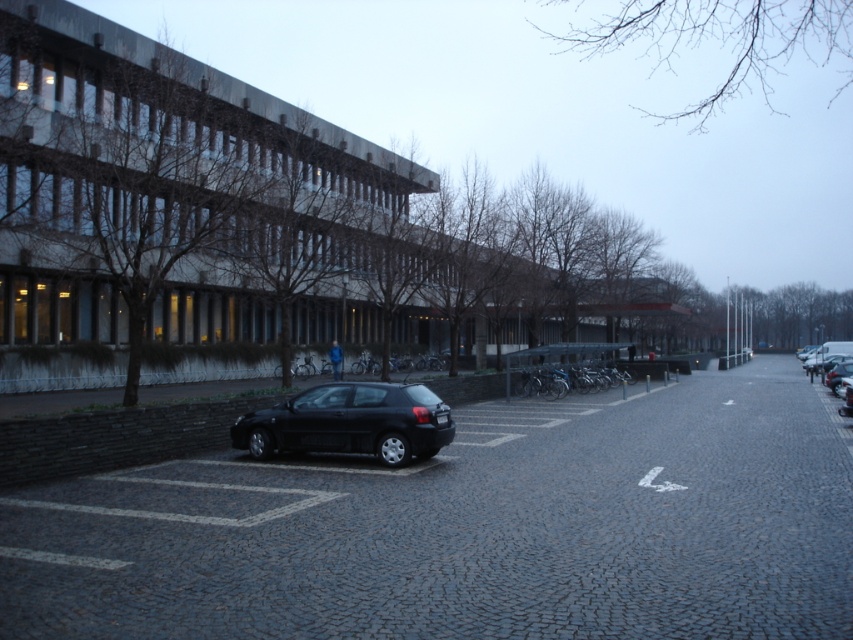
Describe the element at coordinates (469, 529) in the screenshot. The height and width of the screenshot is (640, 853). I see `shiny black car at center-left` at that location.

Does point (234, 627) come closer to viewer compared to point (807, 365)?

Yes, point (234, 627) is in front of point (807, 365).

The image size is (853, 640). Identify the location of shiny black car at center-left. (469, 529).

Is shiny black car at center-left shorter than shiny black hatchback at center?

Correct, shiny black car at center-left is not as tall as shiny black hatchback at center.

Find the location of a particular element. shiny black car at center-left is located at coordinates tap(469, 529).

In order to click on shiny black car at center-left in this screenshot , I will do `click(469, 529)`.

Which is more to the right, shiny black hatchback at center or metallic silver car at right?

metallic silver car at right is more to the right.

Does shiny black hatchback at center come behind metallic silver car at right?

No, shiny black hatchback at center is in front of metallic silver car at right.

Identify the location of shiny black hatchback at center. The height and width of the screenshot is (640, 853). (350, 422).